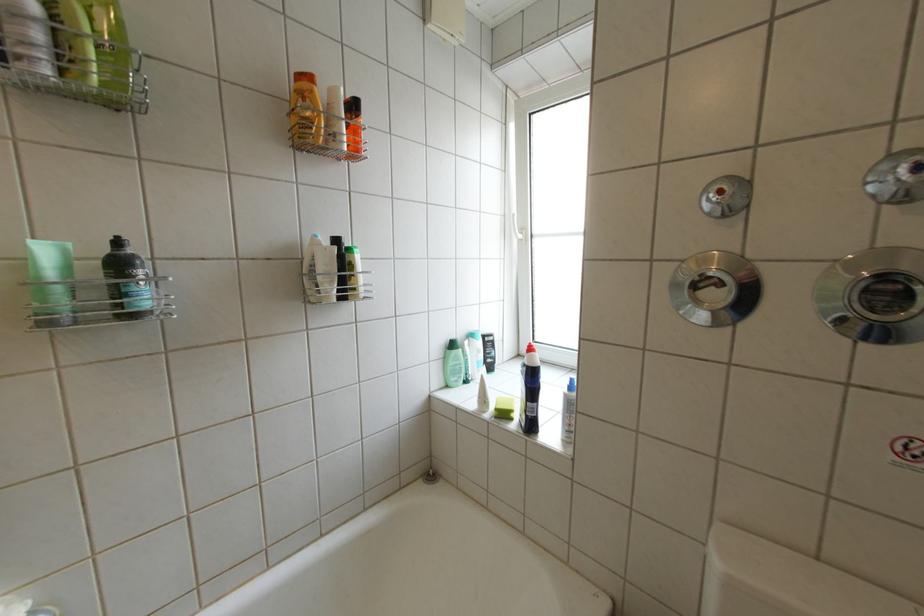
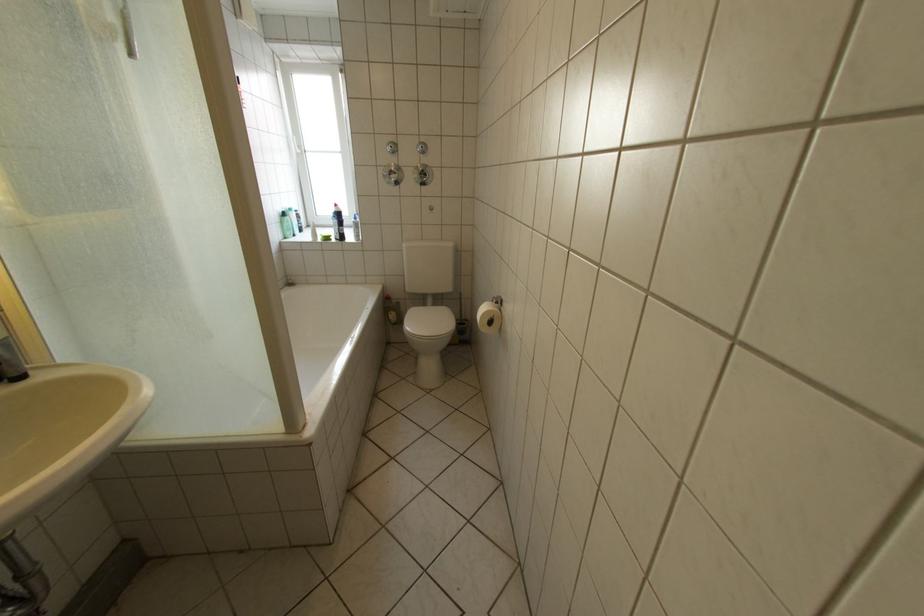
Where in the second image is the point corresponding to pixel 456 359 from the first image?

(294, 224)